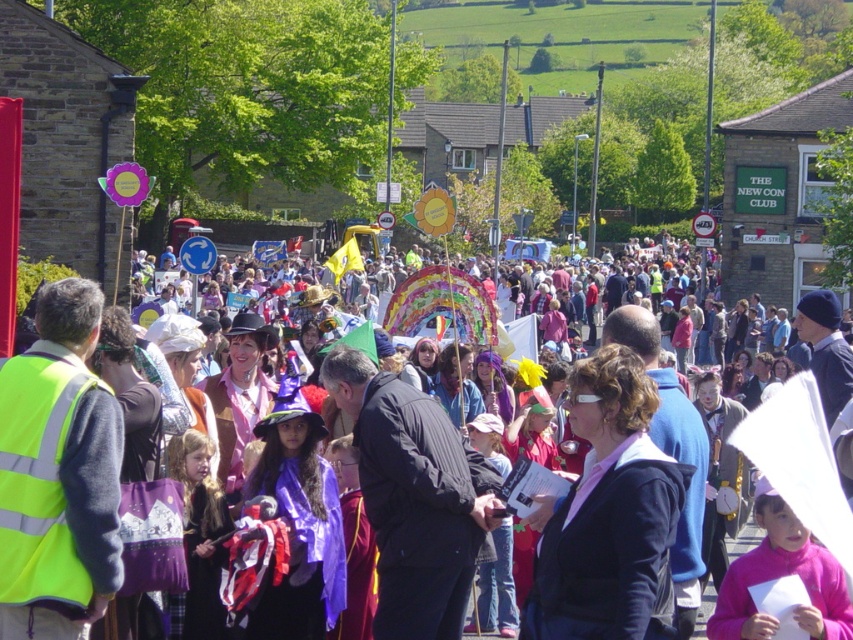
You are a photographer at the event and want to capture a photo that includes both the matte purple costume at center and the pink fabric at center. Based on their positions, which one should you focus on first to ensure both are in the frame?

The matte purple costume at center is located above the pink fabric at center, so you should focus on the pink fabric at center first to ensure both are in the frame.

You are a participant in the parade and need to hand out flyers to both the matte purple costume at center and the pink fabric at center. If your reach is 2 meters, can you hand out flyers to both without moving from your current position?

The distance between the matte purple costume at center and the pink fabric at center is 25.25 meters. Since your reach is only 2 meters, you cannot reach either of them without moving closer.